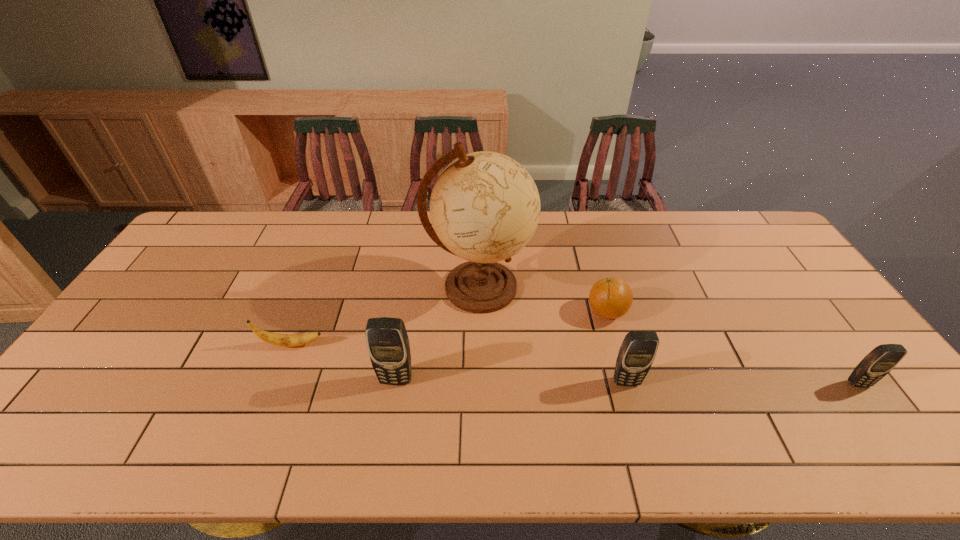
At what (x,y) coordinates should I click in order to perform the action: click on free space located 0.070m on the front face of the second tallest object. Please return your answer as a coordinate pair (x, y). The height and width of the screenshot is (540, 960). Looking at the image, I should click on (391, 413).

Locate an element on the screen. This screenshot has height=540, width=960. free location located on the peel of the third farthest object from the top is located at coordinates (361, 345).

You are a GUI agent. You are given a task and a screenshot of the screen. Output one action in this format:
    pyautogui.click(x=<x>, y=<y>)
    Task: Click on the vacant space located on the right of the orange
    The height and width of the screenshot is (540, 960).
    Given the screenshot: What is the action you would take?
    pyautogui.click(x=726, y=312)

The image size is (960, 540). In order to click on vacant space located on the surface of the globe in this screenshot , I will do `click(658, 287)`.

Where is `object at the right edge`? object at the right edge is located at coordinates (882, 359).

Identify the location of object present at the near right corner. The width and height of the screenshot is (960, 540). (882, 359).

I want to click on free space at the far edge, so click(x=385, y=239).

At what (x,y) coordinates should I click in order to perform the action: click on free region at the near edge. Please return your answer as a coordinate pair (x, y). This screenshot has width=960, height=540. Looking at the image, I should click on (761, 387).

This screenshot has height=540, width=960. In the image, there is a desktop. What are the coordinates of `vacant space at the right edge` in the screenshot? It's located at (836, 332).

Where is `vacant space at the far left corner of the desktop`? vacant space at the far left corner of the desktop is located at coordinates (229, 227).